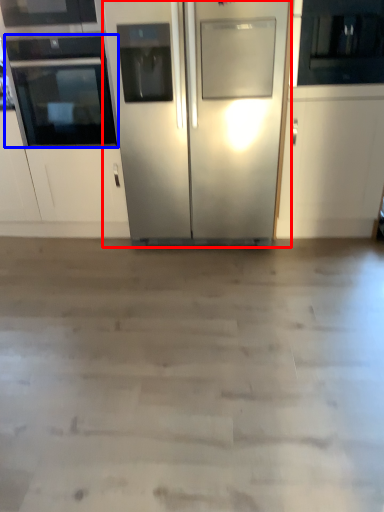
Question: Which of the following is the closest to the observer, refrigerator (highlighted by a red box) or oven (highlighted by a blue box)?

Choices:
 (A) refrigerator
 (B) oven

Answer: (A)